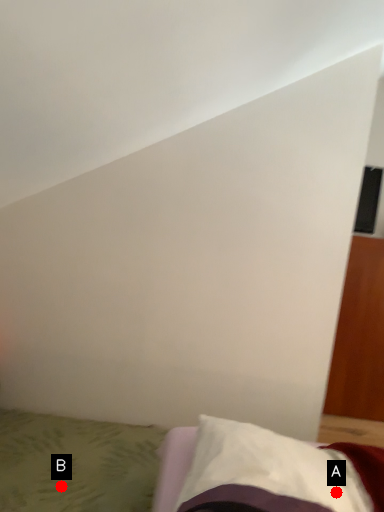
Question: Two points are circled on the image, labeled by A and B beside each circle. Among these points, which one is nearest to the camera?

Choices:
 (A) A is closer
 (B) B is closer

Answer: (A)